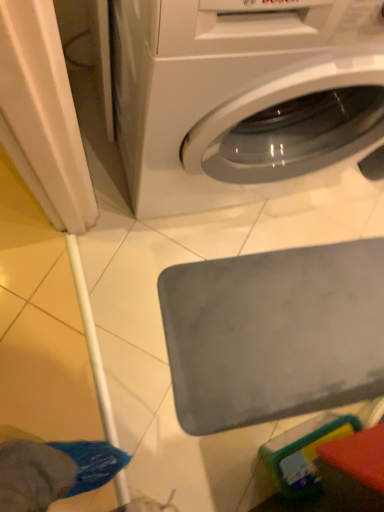
Describe the element at coordinates (243, 97) in the screenshot. I see `white glossy washing machine at upper center` at that location.

This screenshot has width=384, height=512. I want to click on white glossy washing machine at upper center, so 243,97.

Identify the location of white glossy washing machine at upper center. (243, 97).